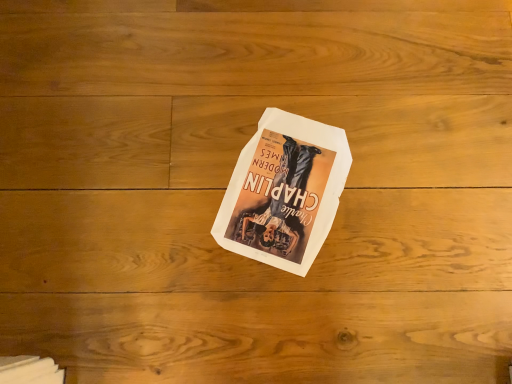
Locate an element on the screen. vacant area situated below white paper at center (from a real-world perspective) is located at coordinates (285, 185).